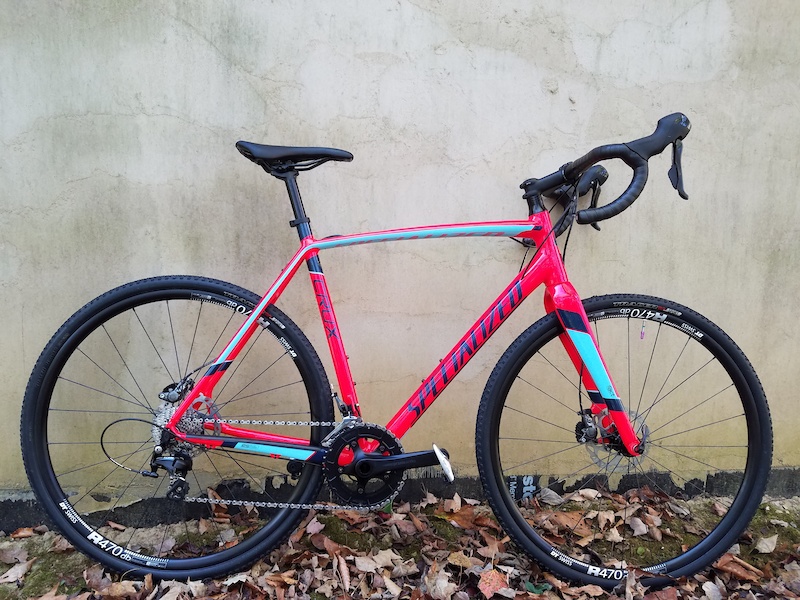
Locate an element on the screen. The width and height of the screenshot is (800, 600). seat is located at coordinates (252, 145).